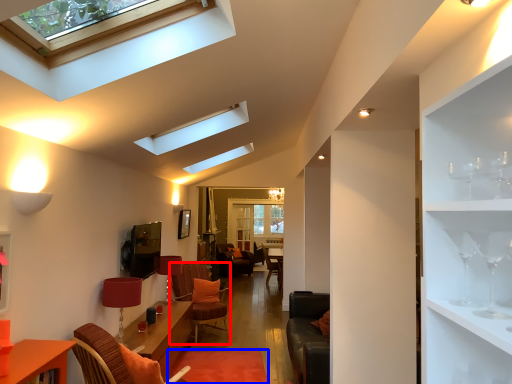
Question: Which of the following is the farthest to the observer, swivel chair (highlighted by a red box) or plain (highlighted by a blue box)?

Choices:
 (A) swivel chair
 (B) plain

Answer: (A)